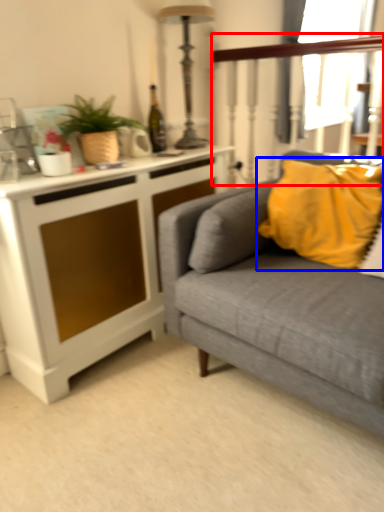
Question: Which object is further to the camera taking this photo, rail (highlighted by a red box) or pillow (highlighted by a blue box)?

Choices:
 (A) rail
 (B) pillow

Answer: (A)